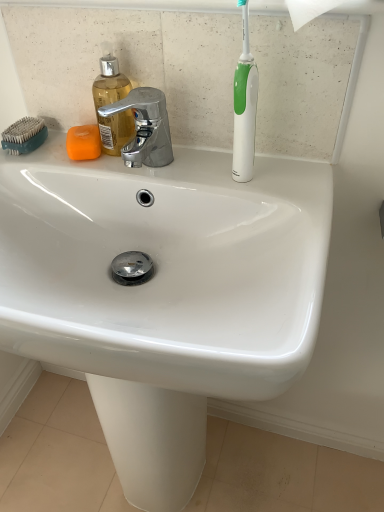
The width and height of the screenshot is (384, 512). I want to click on free space to the right of teal plastic comb at upper left, so click(125, 158).